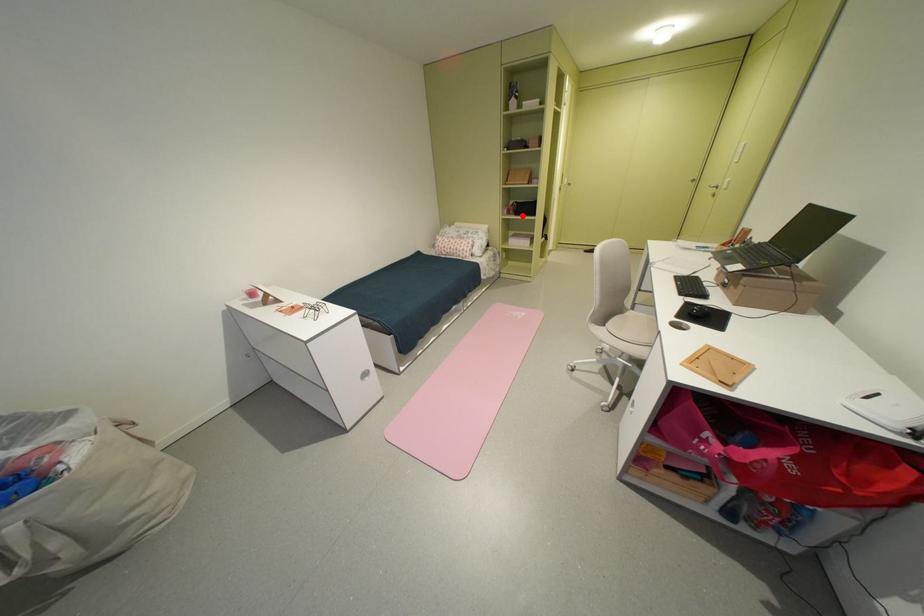
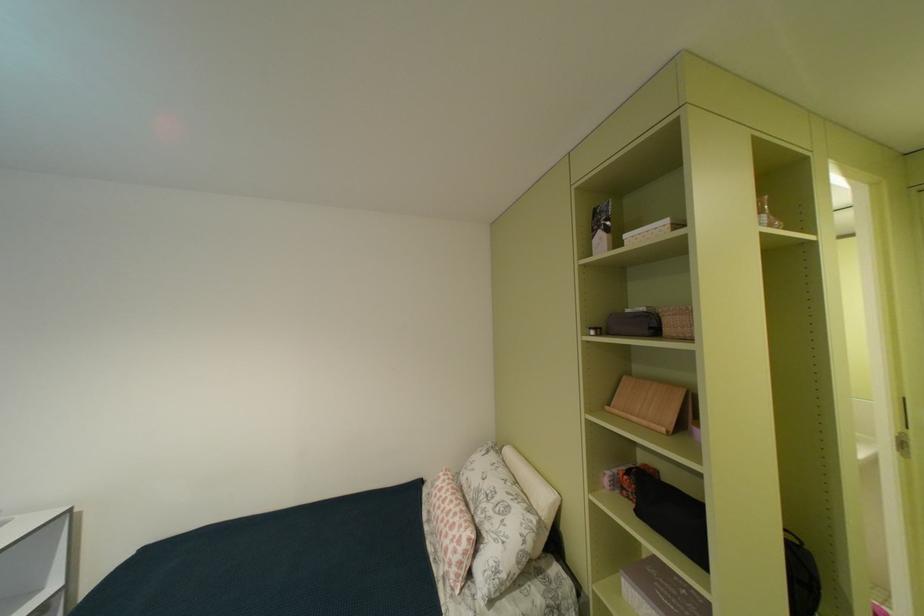
Question: I am providing you with two images of the same scene from different viewpoints. In image1, a red point is highlighted. Considering the same 3D point in image2, which of the following is correct?

Choices:
 (A) It is closer
 (B) It is farther

Answer: (B)